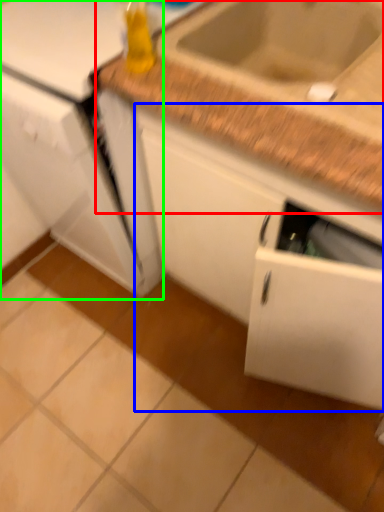
Question: Estimate the real-world distances between objects in this image. Which object is closer to countertop (highlighted by a red box), cabinetry (highlighted by a blue box) or appliance (highlighted by a green box)?

Choices:
 (A) cabinetry
 (B) appliance

Answer: (A)